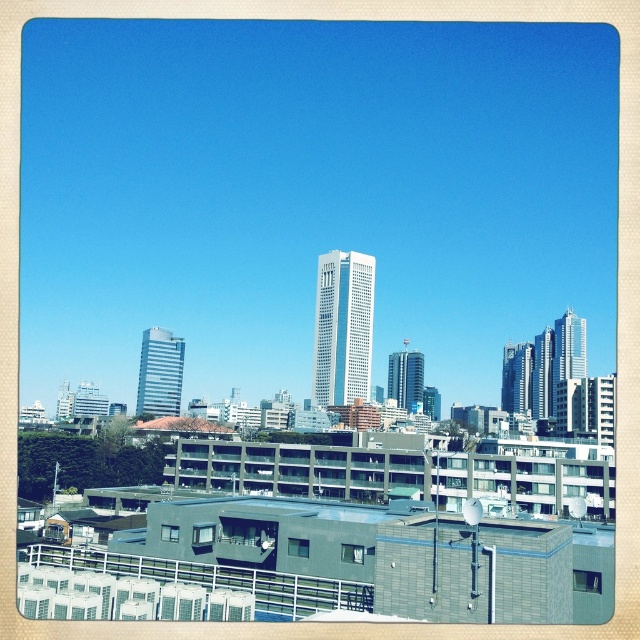
You are standing on the rooftop with air conditioning units and looking at the city. There is a point marked at coordinates (160,372). What does this point correspond to in the scene?

The point at coordinates (160,372) corresponds to the light gray glass skyscraper at center left.

You are an architect analyzing the city layout. Based on the image, which of the two structures, the gray concrete building at center or the sleek glass skyscraper at upper right, has a narrower width?

The gray concrete building at center is thinner than the sleek glass skyscraper at upper right, so the gray concrete building at center has a narrower width.